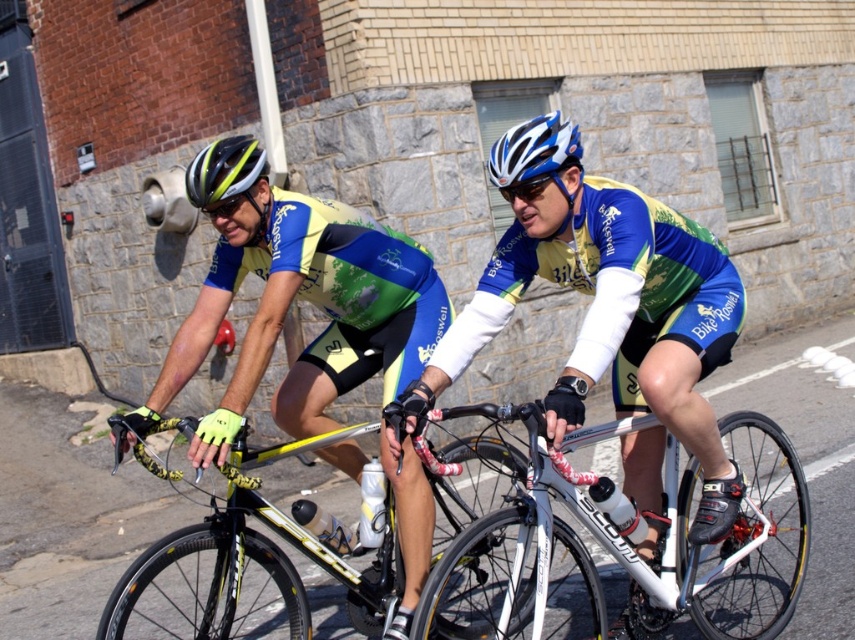
Is blue glossy bicycle helmet at upper center closer to the viewer compared to shiny blue helmet at center?

Yes, it is.

How much distance is there between blue glossy bicycle helmet at upper center and shiny blue helmet at center?

blue glossy bicycle helmet at upper center and shiny blue helmet at center are 1.35 meters apart.

Does point (522, 129) come farther from viewer compared to point (195, 188)?

No, it is in front of (195, 188).

Identify the location of blue glossy bicycle helmet at upper center. The width and height of the screenshot is (855, 640). (534, 150).

Image resolution: width=855 pixels, height=640 pixels. In order to click on yellow-green jersey at center in this screenshot , I will do `click(313, 305)`.

Between yellow-green jersey at center and yellow/glossy bicycle at center, which one is positioned higher?

yellow-green jersey at center is above.

Between point (298, 284) and point (366, 586), which one is positioned in front?

Point (298, 284)

This screenshot has width=855, height=640. In order to click on yellow-green jersey at center in this screenshot , I will do `click(313, 305)`.

Does matte blue cycling jersey at center have a lesser height compared to white metallic bicycle at center?

Incorrect, matte blue cycling jersey at center's height does not fall short of white metallic bicycle at center's.

Does point (582, 337) come closer to viewer compared to point (476, 593)?

Yes.

Locate an element on the screen. matte blue cycling jersey at center is located at coordinates (610, 317).